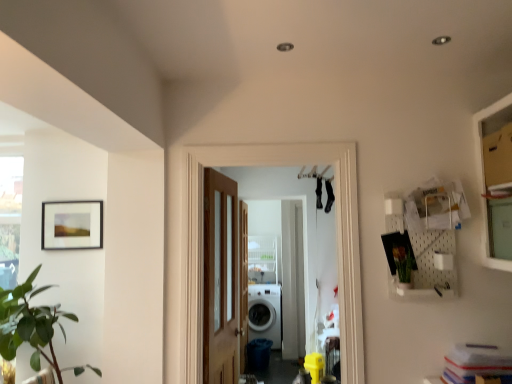
Question: Should I look upward or downward to see clear glass screen door at center?

Choices:
 (A) up
 (B) down

Answer: (B)

Question: Is white glossy washing machine at center not near white pegboard at upper right?

Choices:
 (A) yes
 (B) no

Answer: (A)

Question: Is white glossy washing machine at center outside of white pegboard at upper right?

Choices:
 (A) yes
 (B) no

Answer: (A)

Question: From a real-world perspective, is white glossy washing machine at center located beneath white pegboard at upper right?

Choices:
 (A) no
 (B) yes

Answer: (B)

Question: Is white glossy washing machine at center in front of white pegboard at upper right?

Choices:
 (A) no
 (B) yes

Answer: (A)

Question: Could you tell me if white glossy washing machine at center is facing white pegboard at upper right?

Choices:
 (A) no
 (B) yes

Answer: (B)

Question: Is white pegboard at upper right completely or partially inside white glossy washing machine at center?

Choices:
 (A) yes
 (B) no

Answer: (B)

Question: Would you consider green matte vase at right to be distant from clear glass screen door at center?

Choices:
 (A) no
 (B) yes

Answer: (B)

Question: Would you say clear glass screen door at center is part of green matte vase at right's contents?

Choices:
 (A) yes
 (B) no

Answer: (B)

Question: Is green matte vase at right bigger than clear glass screen door at center?

Choices:
 (A) no
 (B) yes

Answer: (A)

Question: From a real-world perspective, does green matte vase at right sit lower than clear glass screen door at center?

Choices:
 (A) no
 (B) yes

Answer: (A)

Question: From the image's perspective, does green matte vase at right appear lower than clear glass screen door at center?

Choices:
 (A) yes
 (B) no

Answer: (B)

Question: Does green matte vase at right have a lesser width compared to clear glass screen door at center?

Choices:
 (A) yes
 (B) no

Answer: (B)

Question: Can green matte vase at right be found inside white pegboard at upper right?

Choices:
 (A) yes
 (B) no

Answer: (A)